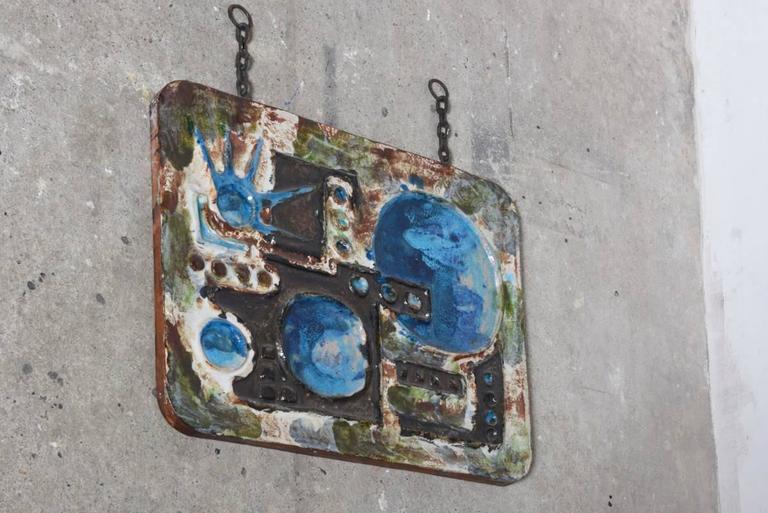
Find the location of a particular element. This screenshot has width=768, height=513. white wall is located at coordinates (700, 177).